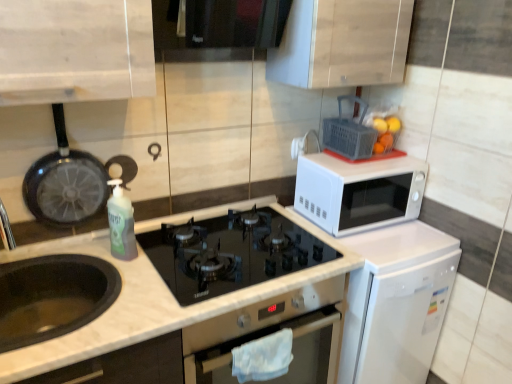
Identify the location of free space above white matte microwave at upper right (from a real-world perspective). This screenshot has width=512, height=384. [x=369, y=158].